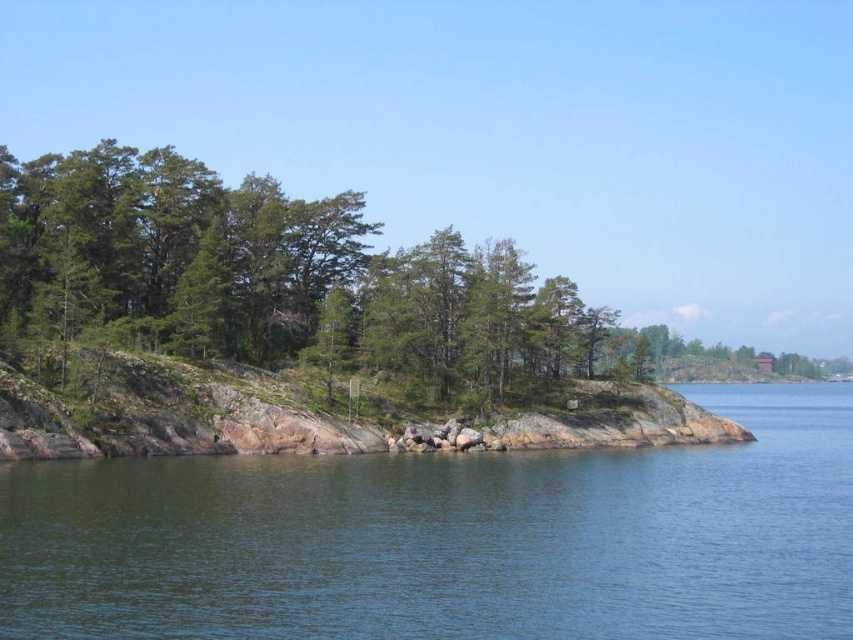
Question: Can you confirm if clear blue water at lower left is positioned below green leafy trees at center?

Choices:
 (A) yes
 (B) no

Answer: (A)

Question: Among these points, which one is farthest from the camera?

Choices:
 (A) (490, 605)
 (B) (398, 330)

Answer: (B)

Question: Does clear blue water at lower left appear over green leafy trees at center?

Choices:
 (A) no
 (B) yes

Answer: (A)

Question: Which object appears closest to the camera in this image?

Choices:
 (A) green leafy trees at center
 (B) clear blue water at lower left

Answer: (B)

Question: Does clear blue water at lower left have a greater width compared to green leafy trees at center?

Choices:
 (A) no
 (B) yes

Answer: (B)

Question: Which of the following is the closest to the observer?

Choices:
 (A) (399, 310)
 (B) (347, 566)

Answer: (B)